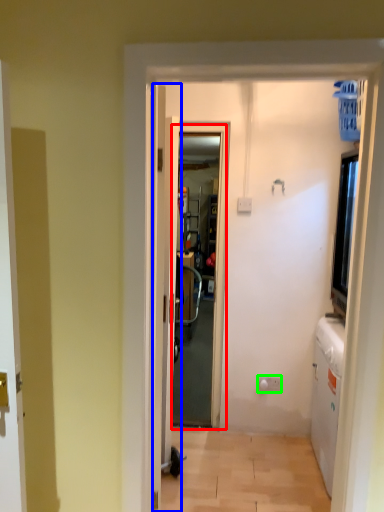
Question: Based on their relative distances, which object is farther from screen door (highlighted by a red box)? Choose from door (highlighted by a blue box) and electric outlet (highlighted by a green box).

Choices:
 (A) door
 (B) electric outlet

Answer: (B)